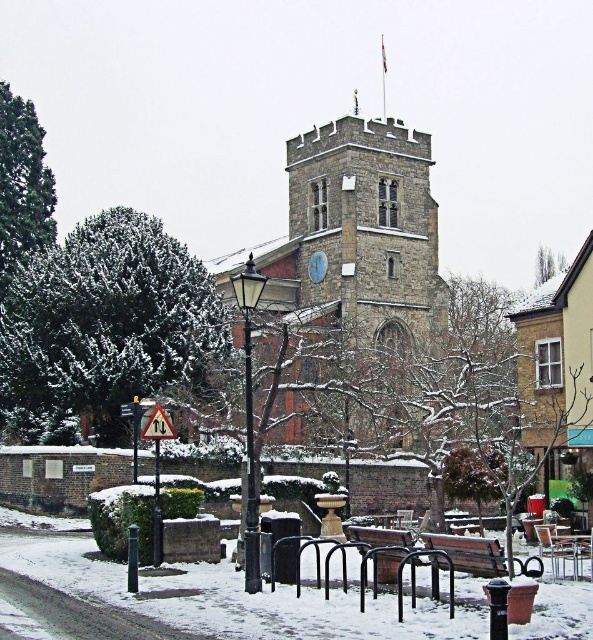
You are standing at the point labeled as point [352,250] in the winter scene. Based on the description, what structure are you directly facing?

The point [352,250] corresponds to the stone clock tower at center, so you are directly facing the stone clock tower at center.

You are a tourist standing at the wooden bench at center. You want to take a photo of the stone clock tower at center. Considering the distance between them, is the tower likely to be in focus if you use a standard smartphone camera with a focal length of 28mm and an aperture of f2.8? Explain your reasoning.

The stone clock tower at center is 51.62 meters from the wooden bench at center. At a distance of 51.62 meters with a smartphone camera set to 28mm focal length and f2.8 aperture, the depth of field would likely keep the tower in focus since most smartphone cameras have sensors small enough that depth of field remains sufficient at such distances, even with a relatively wide aperture like f2.8.